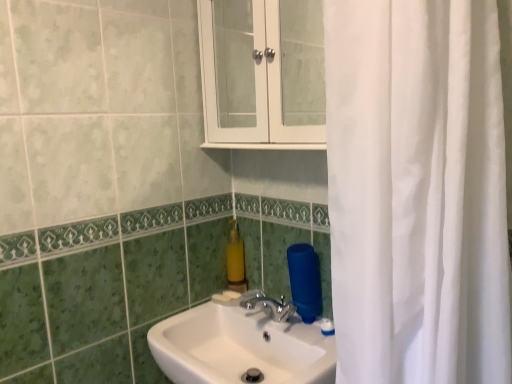
Question: Does white glossy sink at center have a larger size compared to yellow matte soap dispenser at center?

Choices:
 (A) yes
 (B) no

Answer: (A)

Question: Does white glossy sink at center lie in front of yellow matte soap dispenser at center?

Choices:
 (A) yes
 (B) no

Answer: (A)

Question: Is yellow matte soap dispenser at center completely or partially inside white glossy sink at center?

Choices:
 (A) yes
 (B) no

Answer: (B)

Question: Could you tell me if white glossy sink at center is facing yellow matte soap dispenser at center?

Choices:
 (A) yes
 (B) no

Answer: (B)

Question: Is white glossy sink at center to the left of yellow matte soap dispenser at center from the viewer's perspective?

Choices:
 (A) yes
 (B) no

Answer: (B)

Question: Is white glossy sink at center in front of or behind yellow matte soap dispenser at center in the image?

Choices:
 (A) behind
 (B) front

Answer: (B)

Question: From a real-world perspective, relative to yellow matte soap dispenser at center, is white glossy sink at center vertically above or below?

Choices:
 (A) below
 (B) above

Answer: (A)

Question: Is white glossy sink at center bigger or smaller than yellow matte soap dispenser at center?

Choices:
 (A) big
 (B) small

Answer: (A)

Question: Based on their positions, is white glossy sink at center located to the left or right of yellow matte soap dispenser at center?

Choices:
 (A) right
 (B) left

Answer: (A)

Question: Based on their positions, is white glossy cabinet at upper center located to the left or right of white glossy sink at center?

Choices:
 (A) right
 (B) left

Answer: (A)

Question: Is white glossy cabinet at upper center inside or outside of white glossy sink at center?

Choices:
 (A) outside
 (B) inside

Answer: (A)

Question: Is point (227, 26) positioned closer to the camera than point (222, 365)?

Choices:
 (A) closer
 (B) farther

Answer: (B)

Question: Is white glossy cabinet at upper center in front of or behind white glossy sink at center in the image?

Choices:
 (A) behind
 (B) front

Answer: (A)

Question: Considering the positions of white glossy cabinet at upper center and yellow matte soap dispenser at center in the image, is white glossy cabinet at upper center wider or thinner than yellow matte soap dispenser at center?

Choices:
 (A) thin
 (B) wide

Answer: (B)

Question: Considering the positions of point (223, 79) and point (238, 284), is point (223, 79) closer or farther from the camera than point (238, 284)?

Choices:
 (A) closer
 (B) farther

Answer: (A)